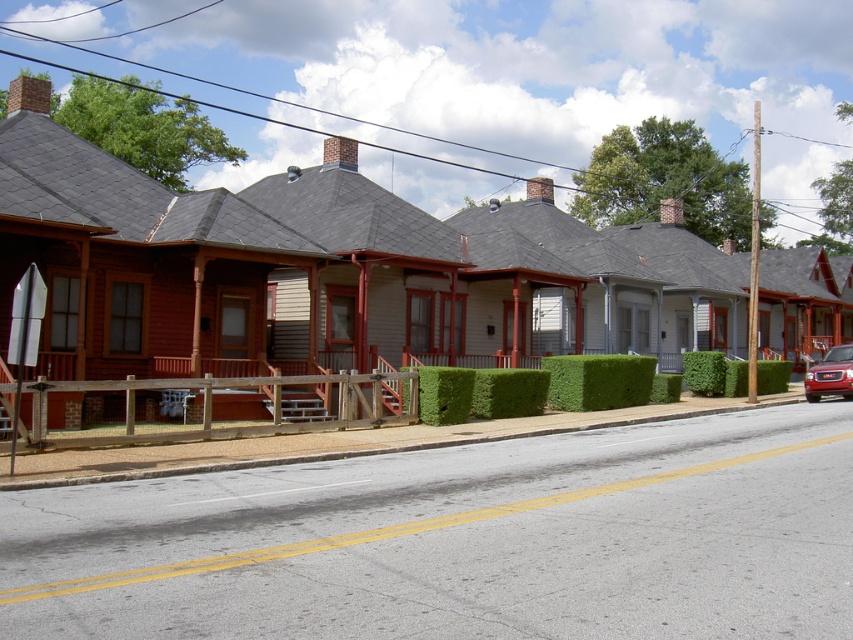
You are standing on the sidewalk in front of the row of houses. You want to find the green leafy hedge at center. Based on the coordinates provided, where should you look relative to the houses?

Answer: The green leafy hedge at center is located at coordinates (598, 380), which would be towards the middle section of the row of houses, slightly to the right of the center point.